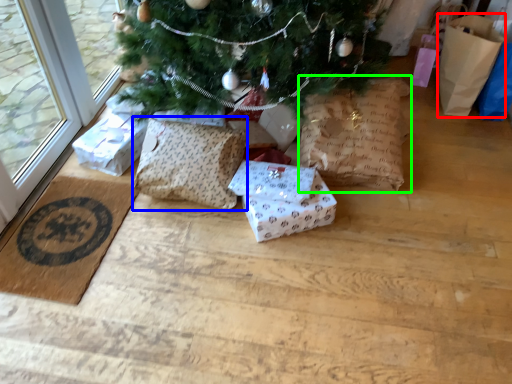
Question: Which object is the farthest from gift bag (highlighted by a red box)? Choose among these: pillow (highlighted by a blue box) or shopping bag (highlighted by a green box).

Choices:
 (A) pillow
 (B) shopping bag

Answer: (A)